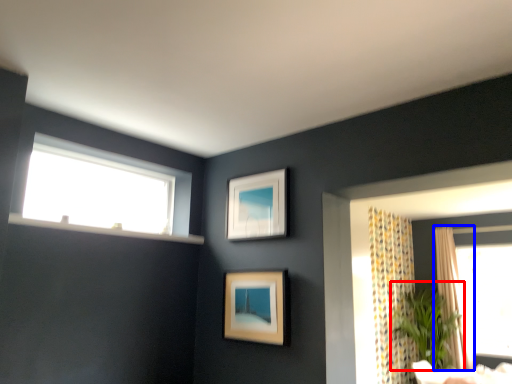
Question: Among these objects, which one is farthest to the camera, plant (highlighted by a red box) or curtain (highlighted by a blue box)?

Choices:
 (A) plant
 (B) curtain

Answer: (B)